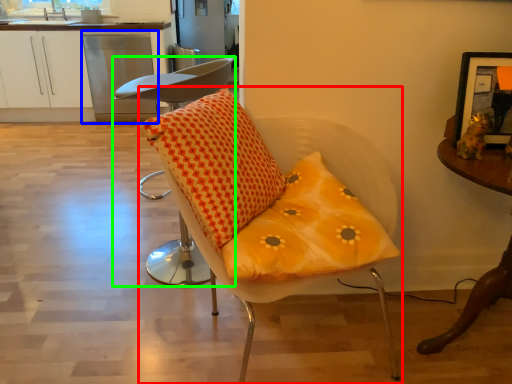
Question: Considering the real-world distances, which object is closest to chair (highlighted by a red box)? dish washer (highlighted by a blue box) or chair (highlighted by a green box).

Choices:
 (A) dish washer
 (B) chair

Answer: (B)